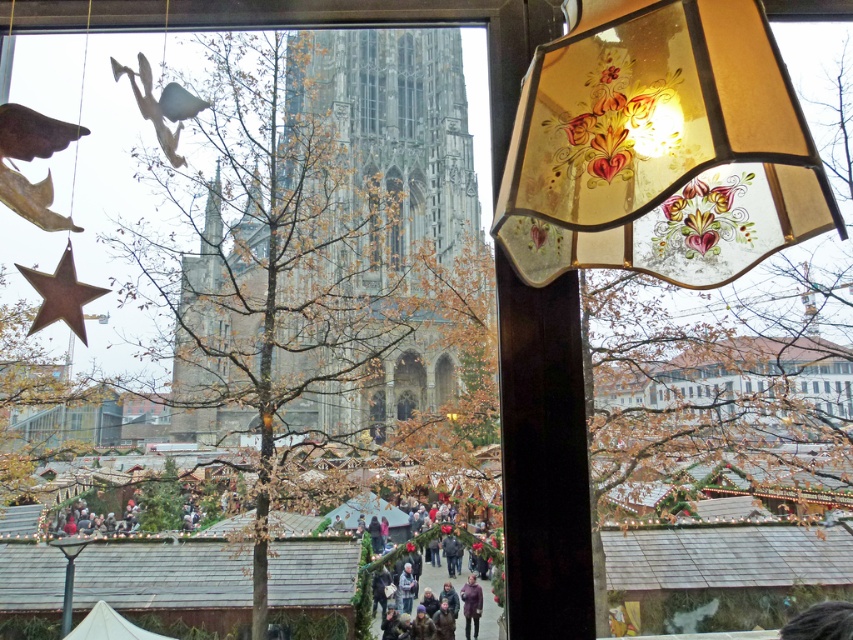
Can you confirm if translucent stained glass lampshade at upper right is positioned to the left of purple matte jacket at center?

In fact, translucent stained glass lampshade at upper right is to the right of purple matte jacket at center.

Between point (688, 76) and point (465, 637), which one is positioned in front?

Point (688, 76) is in front.

The image size is (853, 640). What are the coordinates of `translucent stained glass lampshade at upper right` in the screenshot? It's located at (659, 147).

Who is shorter, matte green fabric canopy at center or purple matte jacket at center?

Standing shorter between the two is purple matte jacket at center.

Measure the distance between point (401, 525) and camera.

97.33 meters

Where is `matte green fabric canopy at center`? Image resolution: width=853 pixels, height=640 pixels. matte green fabric canopy at center is located at coordinates (372, 515).

Looking at this image, who is more forward, (126, 625) or (474, 634)?

Point (126, 625) is more forward.

This screenshot has height=640, width=853. I want to click on white fabric canopy at lower left, so click(109, 627).

Between point (74, 627) and point (479, 593), which one is positioned behind?

The point (479, 593) is behind.

The width and height of the screenshot is (853, 640). I want to click on white fabric canopy at lower left, so click(109, 627).